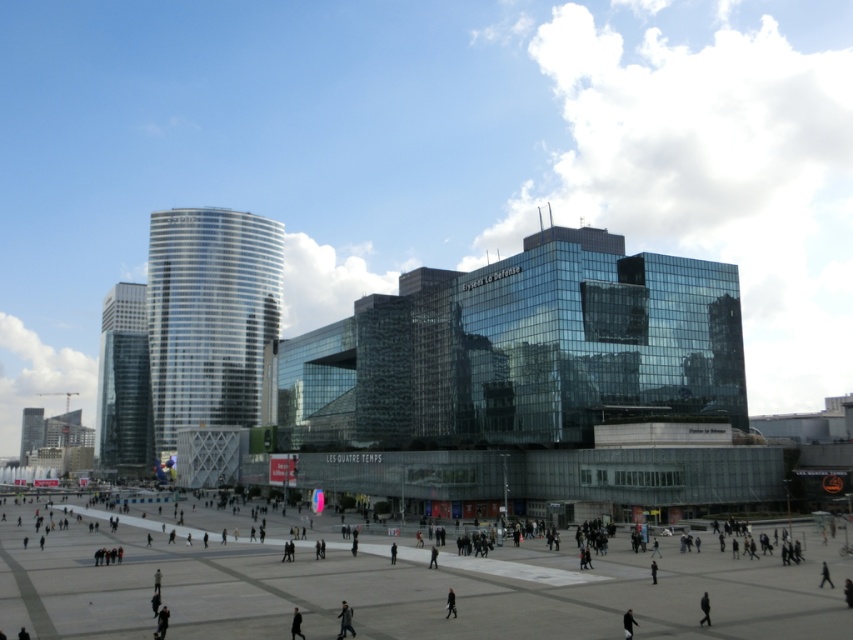
Who is taller, concrete plaza at center or glassy skyscraper at left?

glassy skyscraper at left

Looking at this image, is concrete plaza at center smaller than glassy skyscraper at left?

Correct, concrete plaza at center occupies less space than glassy skyscraper at left.

Who is more forward, (428, 580) or (28, 440)?

Point (428, 580) is in front.

Image resolution: width=853 pixels, height=640 pixels. I want to click on concrete plaza at center, so click(396, 582).

Consider the image. Measure the distance between transparent glass skyscraper at left and camera.

transparent glass skyscraper at left and camera are 644.84 feet apart from each other.

Who is more distant from viewer, (x=132, y=298) or (x=351, y=612)?

The point (x=132, y=298) is behind.

This screenshot has height=640, width=853. I want to click on transparent glass skyscraper at left, so click(x=123, y=384).

What do you see at coordinates (396, 582) in the screenshot? I see `concrete plaza at center` at bounding box center [396, 582].

Is concrete plaza at center behind dark gray jacket at center?

That is False.

Is point (276, 572) more distant than point (345, 621)?

That is True.

What are the coordinates of `concrete plaza at center` in the screenshot? It's located at (396, 582).